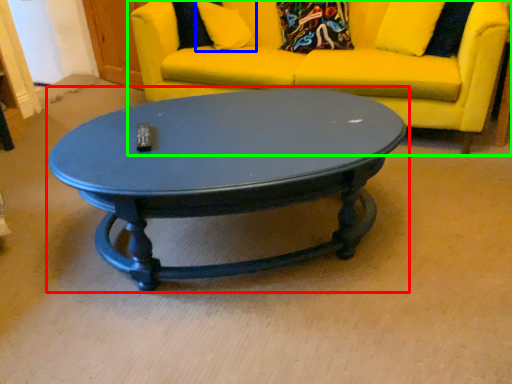
Question: Which is farther away from coffee table (highlighted by a red box)? pillow (highlighted by a blue box) or studio couch (highlighted by a green box)?

Choices:
 (A) pillow
 (B) studio couch

Answer: (A)